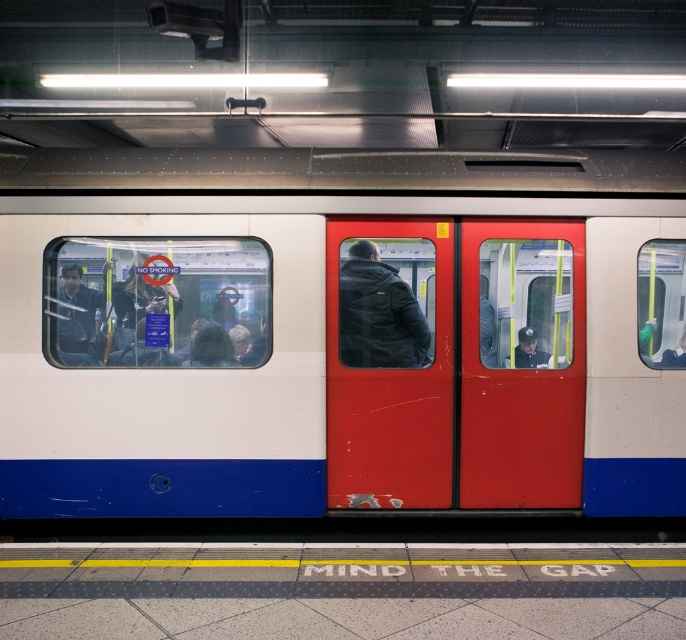
Question: Can you confirm if smooth red door at center is thinner than dark blue uniform at center?

Choices:
 (A) no
 (B) yes

Answer: (A)

Question: Which object is positioned farthest from the dark blue leather jacket at center?

Choices:
 (A) white glossy train at center
 (B) metallic red door at center

Answer: (B)

Question: Estimate the real-world distances between objects in this image. Which object is closer to the smooth red door at center?

Choices:
 (A) dark blue uniform at center
 (B) metallic red door at center
 (C) matte black jacket at left
 (D) dark blue leather jacket at center

Answer: (D)

Question: Is metallic red door at center bigger than matte black jacket at left?

Choices:
 (A) yes
 (B) no

Answer: (A)

Question: Which of these objects is positioned closest to the smooth red door at center?

Choices:
 (A) dark blue leather jacket at center
 (B) dark blue uniform at center
 (C) white glossy train at center

Answer: (A)

Question: Does white glossy train at center appear over matte black jacket at left?

Choices:
 (A) yes
 (B) no

Answer: (A)